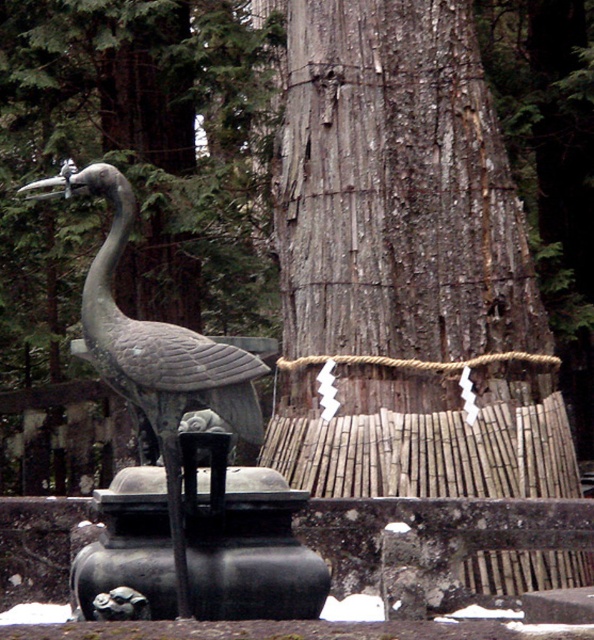
Measure the distance between gray textured wood at center and green patina statue at left.

A distance of 35.64 feet exists between gray textured wood at center and green patina statue at left.

Does gray textured wood at center appear on the right side of green patina statue at left?

Yes, gray textured wood at center is to the right of green patina statue at left.

Identify the location of gray textured wood at center. Image resolution: width=594 pixels, height=640 pixels. (397, 189).